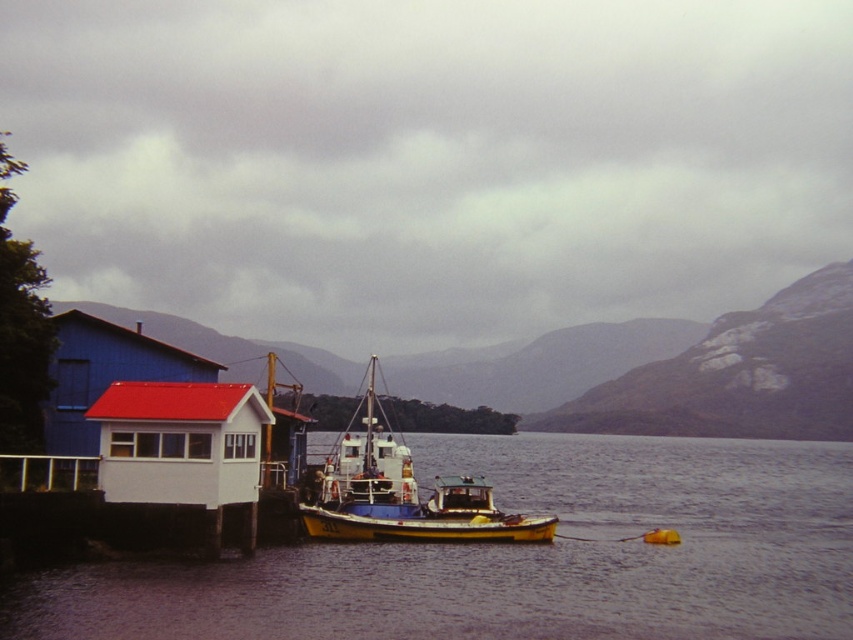
You are navigating a small boat on the lake and need to dock near the white matte building at left. Given that the coordinates of the building are at point 0.581, 0.789, can you determine if the boat can safely approach the building from the water side?

The white matte building at left is located at point (672, 371). Since the building is situated on stilts over the water, the boat can safely approach it from the water side as there is no obstruction.